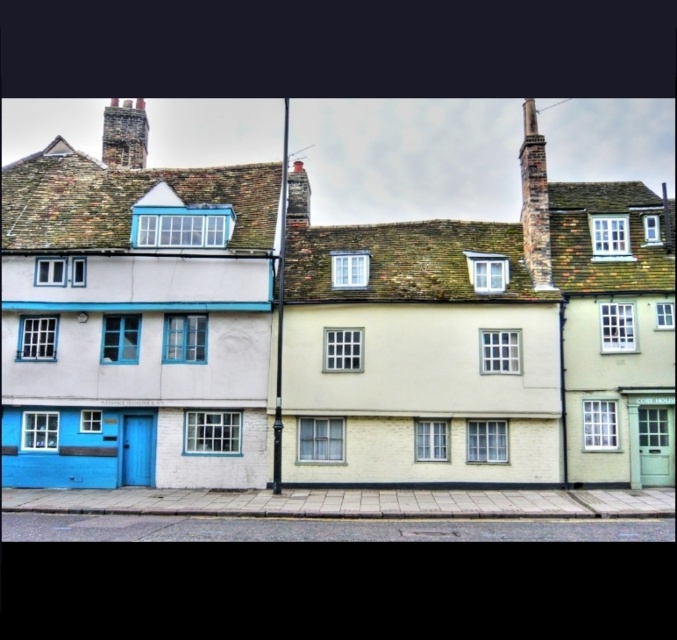
Question: Which object appears closest to the camera in this image?

Choices:
 (A) rustic brick chimney at upper right
 (B) smooth brick chimney at center

Answer: (A)

Question: From the image, what is the correct spatial relationship of rustic stone chimney at upper left in relation to smooth brick chimney at center?

Choices:
 (A) left
 (B) right

Answer: (A)

Question: Can you confirm if rustic brick chimney at upper right is positioned above smooth brick chimney at center?

Choices:
 (A) yes
 (B) no

Answer: (B)

Question: Which of these objects is positioned farthest from the rustic stone chimney at upper left?

Choices:
 (A) smooth brick chimney at center
 (B) rustic brick chimney at upper right

Answer: (B)

Question: Is rustic brick chimney at upper right to the left of rustic stone chimney at upper left from the viewer's perspective?

Choices:
 (A) yes
 (B) no

Answer: (B)

Question: Which of the following is the farthest from the observer?

Choices:
 (A) (297, 198)
 (B) (118, 132)
 (C) (524, 248)

Answer: (B)